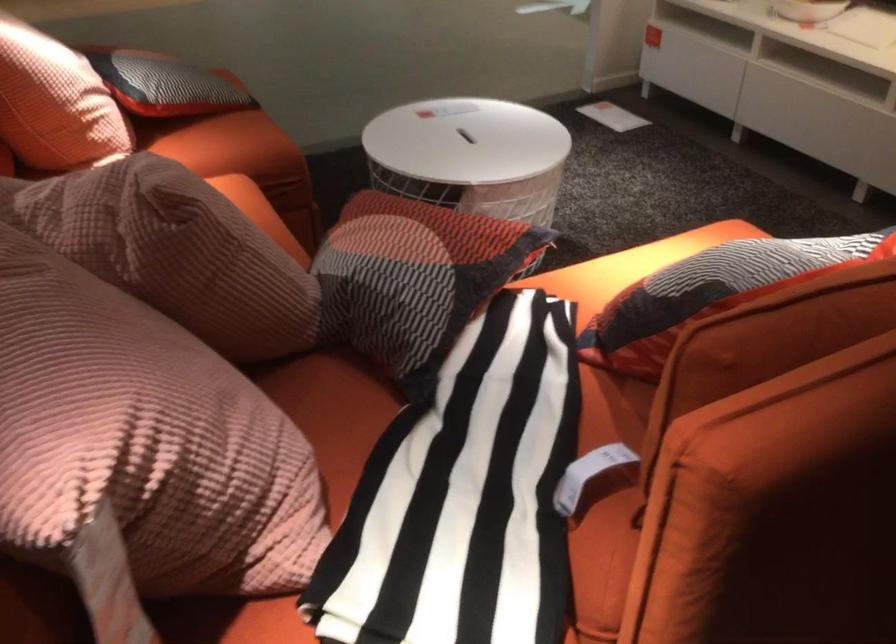
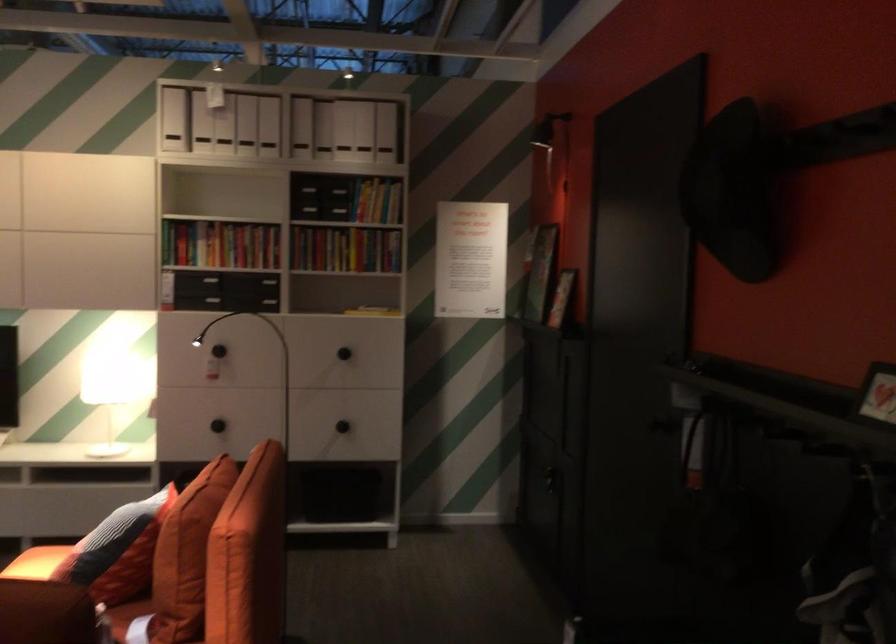
Where in the second image is the point corresponding to point (682, 410) from the first image?

(186, 554)